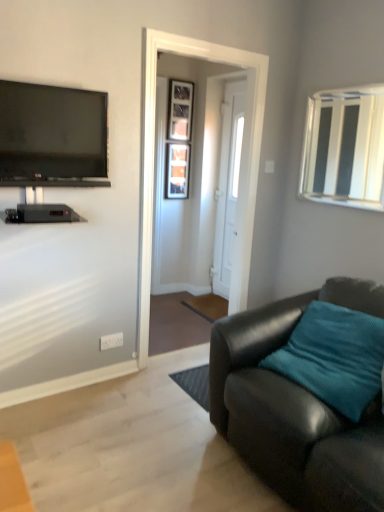
Question: Is white glossy door at center to the right of white plastic power outlet at lower center from the viewer's perspective?

Choices:
 (A) no
 (B) yes

Answer: (B)

Question: Is white glossy door at center taller than white plastic power outlet at lower center?

Choices:
 (A) no
 (B) yes

Answer: (B)

Question: From a real-world perspective, does white glossy door at center stand above white plastic power outlet at lower center?

Choices:
 (A) no
 (B) yes

Answer: (B)

Question: From the image's perspective, does white glossy door at center appear lower than white plastic power outlet at lower center?

Choices:
 (A) yes
 (B) no

Answer: (B)

Question: Considering the relative sizes of white glossy door at center and white plastic power outlet at lower center in the image provided, is white glossy door at center bigger than white plastic power outlet at lower center?

Choices:
 (A) no
 (B) yes

Answer: (B)

Question: From a real-world perspective, relative to white glossy door at center, is white plastic window at upper right, the first window when ordered from front to back, vertically above or below?

Choices:
 (A) above
 (B) below

Answer: (A)

Question: Based on their positions, is white plastic window at upper right, which is the 2th window from left to right, located to the left or right of white glossy door at center?

Choices:
 (A) left
 (B) right

Answer: (B)

Question: Is white plastic window at upper right, which is the 2th window from left to right, taller or shorter than white glossy door at center?

Choices:
 (A) short
 (B) tall

Answer: (A)

Question: Relative to white glossy door at center, is white plastic window at upper right, which is the second window in back-to-front order, in front or behind?

Choices:
 (A) behind
 (B) front

Answer: (B)

Question: From the image's perspective, is matte black couch at lower right positioned above or below white glossy door at center?

Choices:
 (A) below
 (B) above

Answer: (A)

Question: Is matte black couch at lower right inside or outside of white glossy door at center?

Choices:
 (A) inside
 (B) outside

Answer: (B)

Question: Considering their positions, is matte black couch at lower right located in front of or behind white glossy door at center?

Choices:
 (A) behind
 (B) front

Answer: (B)

Question: From a real-world perspective, is matte black couch at lower right physically located above or below white glossy door at center?

Choices:
 (A) below
 (B) above

Answer: (A)

Question: From the image's perspective, relative to white glossy door at center, is matte black couch at lower right above or below?

Choices:
 (A) below
 (B) above

Answer: (A)

Question: Visually, is matte black couch at lower right positioned to the left or to the right of white glossy door at center?

Choices:
 (A) left
 (B) right

Answer: (B)